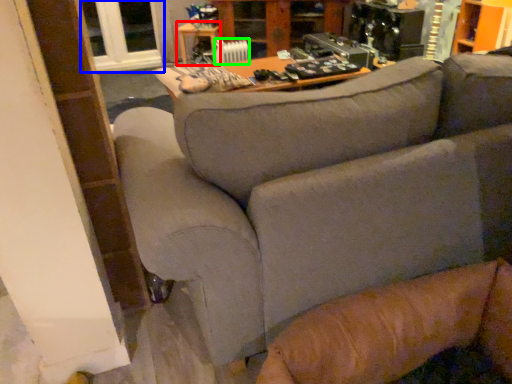
Question: Estimate the real-world distances between objects in this image. Which object is farther from table (highlighted by a red box), window (highlighted by a blue box) or radiator (highlighted by a green box)?

Choices:
 (A) window
 (B) radiator

Answer: (B)